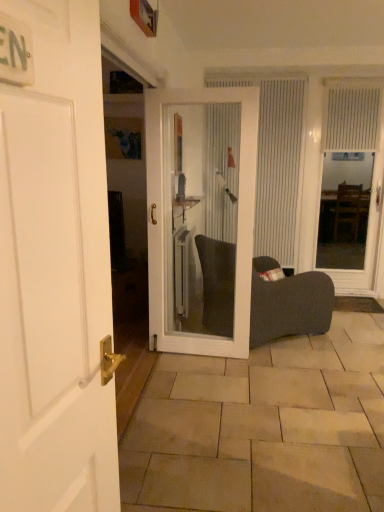
Image resolution: width=384 pixels, height=512 pixels. I want to click on vacant space in front of dark fabric chair at center, so click(278, 380).